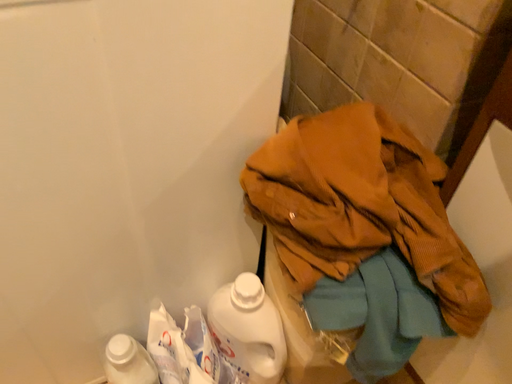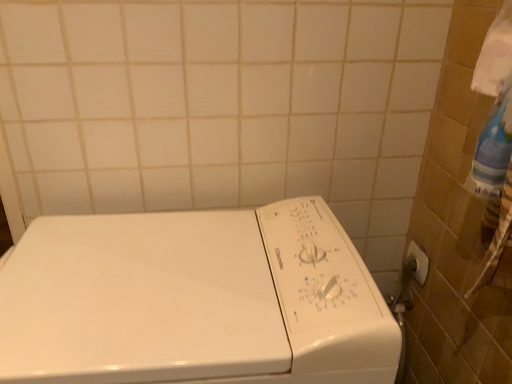
Question: Which way did the camera rotate in the video?

Choices:
 (A) rotated right
 (B) rotated left

Answer: (B)